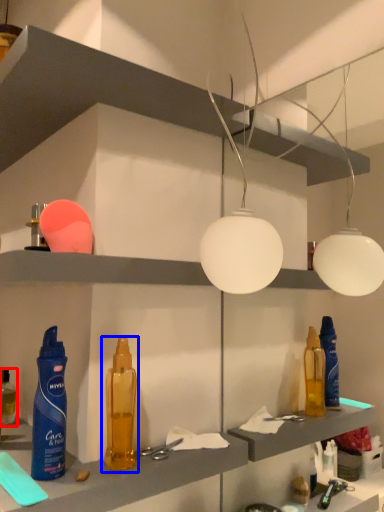
Question: Which point is further to the camera, bottle (highlighted by a red box) or bottle (highlighted by a blue box)?

Choices:
 (A) bottle
 (B) bottle

Answer: (A)